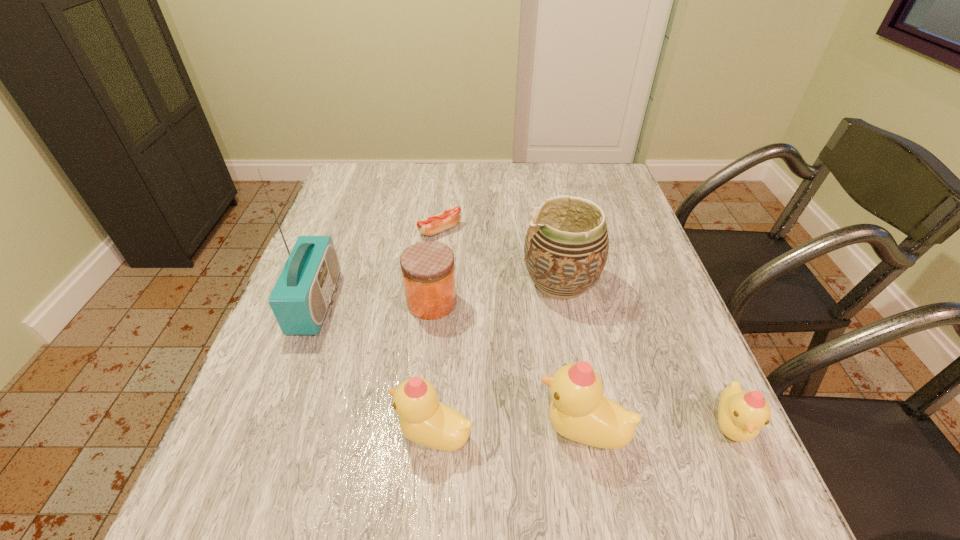
I want to click on vacant area that lies between the second tallest object and the jar, so click(495, 293).

Locate an element on the screen. Image resolution: width=960 pixels, height=540 pixels. vacant space in between the second duckling from right to left and the second tallest duckling is located at coordinates (508, 432).

What are the coordinates of `empty space that is in between the leftmost object and the rightmost duckling` in the screenshot? It's located at (523, 364).

Find the location of `free space between the leftmost object and the shortest duckling`. free space between the leftmost object and the shortest duckling is located at coordinates (523, 364).

This screenshot has width=960, height=540. I want to click on free space that is in between the sausage and the sixth shortest object, so click(500, 256).

The width and height of the screenshot is (960, 540). Identify the location of vacant area between the leftmost object and the second duckling from left to right. (449, 366).

At what (x,y) coordinates should I click in order to perform the action: click on vacant space that's between the pottery and the farthest object. Please return your answer as a coordinate pair (x, y). The height and width of the screenshot is (540, 960). Looking at the image, I should click on (500, 256).

What are the coordinates of `free spot between the second duckling from left to right and the shortest object` in the screenshot? It's located at (512, 330).

Choose which object is the nearest neighbor to the jar. Please provide its 2D coordinates. Your answer should be formatted as a tuple, i.e. [(x, y)], where the tuple contains the x and y coordinates of a point satisfying the conditions above.

[(566, 247)]

Choose which object is the fourth nearest neighbor to the sixth shortest object. Please provide its 2D coordinates. Your answer should be formatted as a tuple, i.e. [(x, y)], where the tuple contains the x and y coordinates of a point satisfying the conditions above.

[(741, 414)]